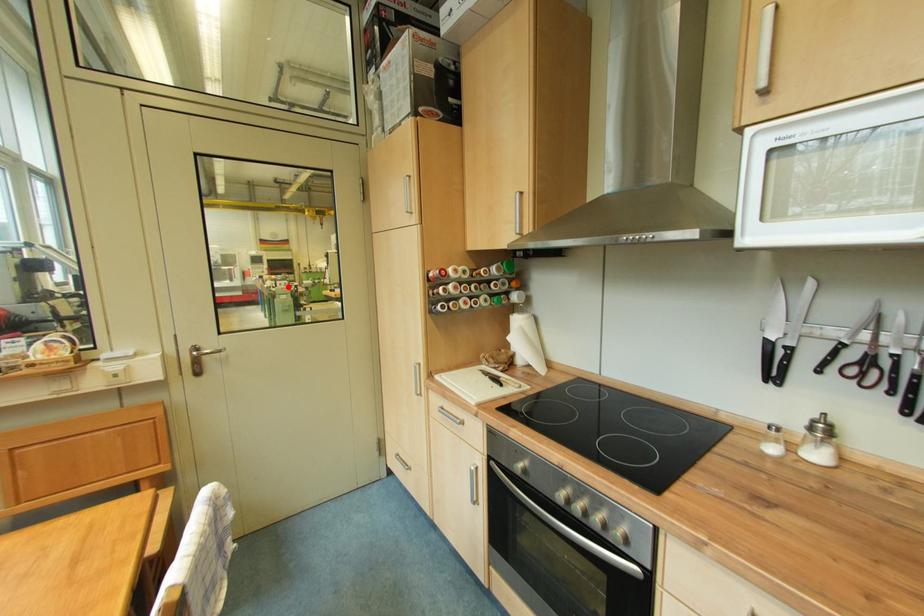
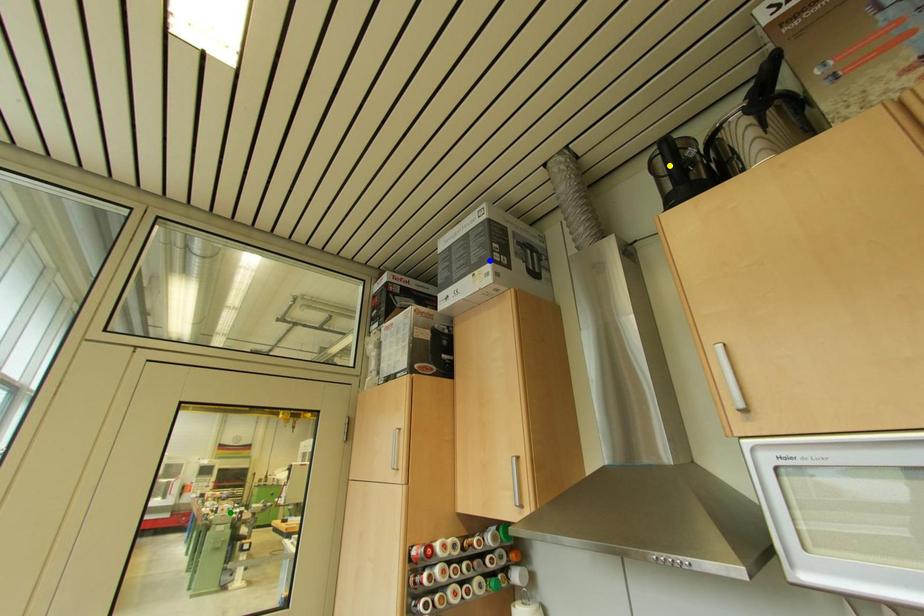
Question: I am providing you with two images of the same scene from different viewpoints. A red point is marked on the first image. You are given multiple points on the second image. Which point in image 2 represents the same 3d spot as the red point in image 1?

Choices:
 (A) blue point
 (B) green point
 (C) yellow point

Answer: (B)